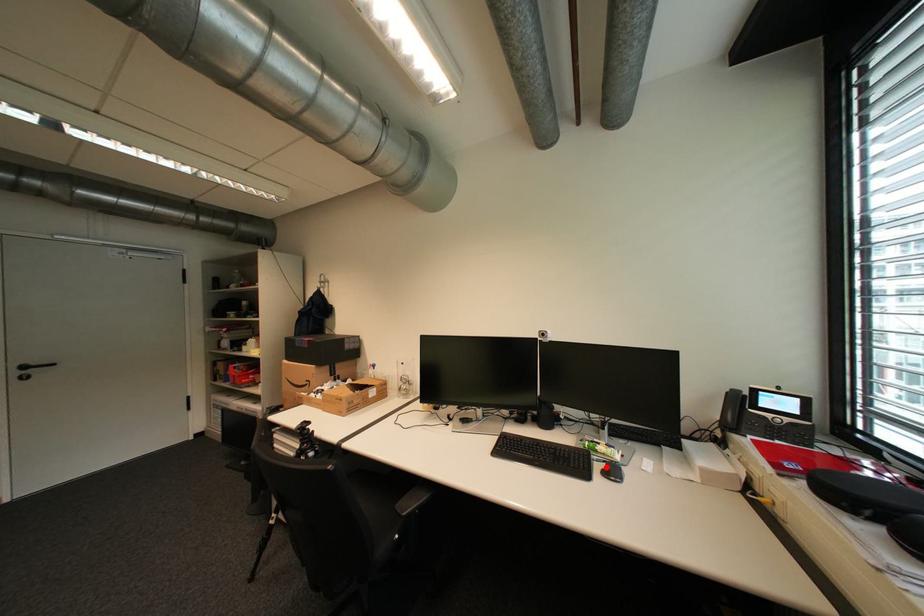
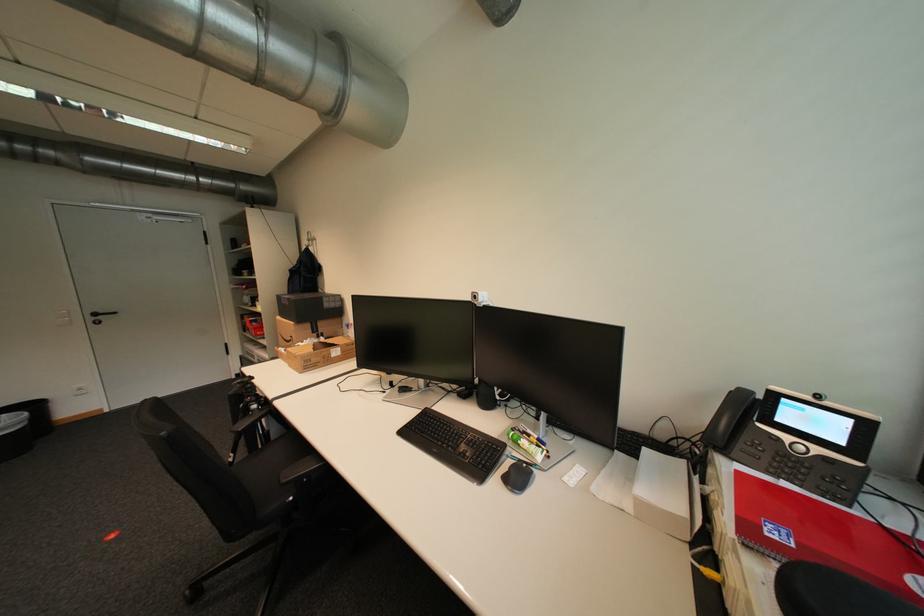
Find the pixel in the second image that matches the highlighted location in the first image.

(514, 467)